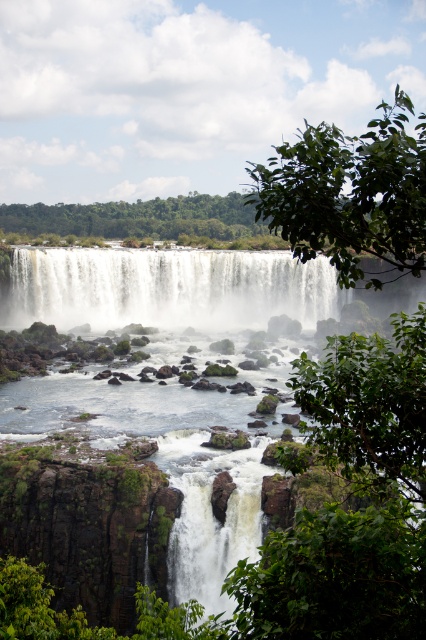
Between white misty water at center and white misty waterfall at center, which one has more height?

Standing taller between the two is white misty water at center.

Does white misty water at center have a lesser height compared to white misty waterfall at center?

No, white misty water at center is not shorter than white misty waterfall at center.

Where is `white misty water at center`? white misty water at center is located at coordinates (88, 524).